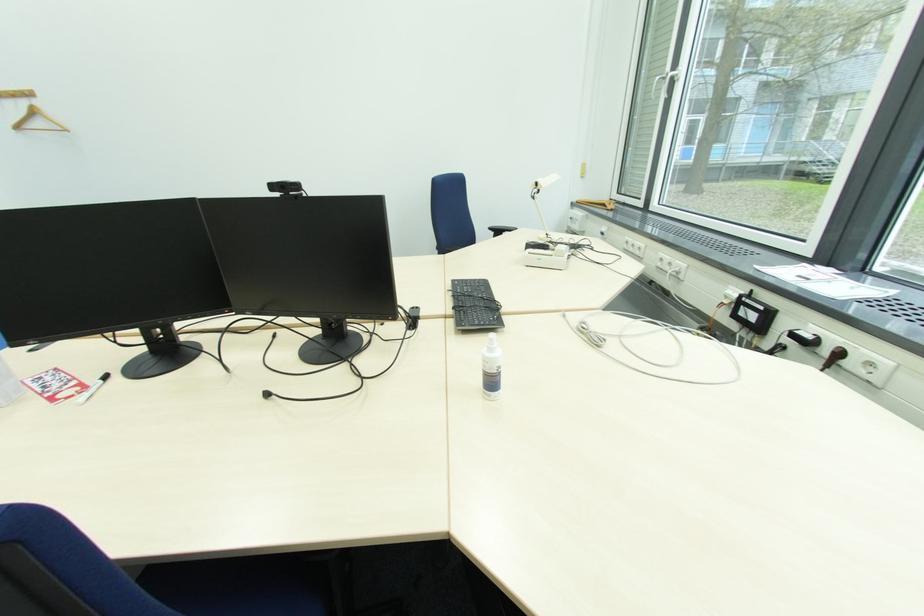
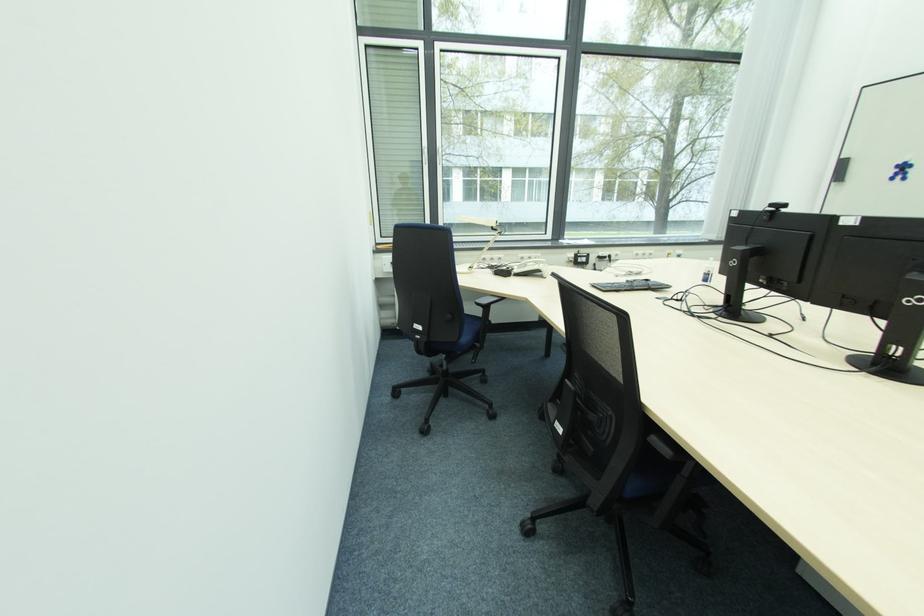
Question: I am providing you with two images of the same scene from different viewpoints. After the viewpoint changes to image2, which objects are now occluded?

Choices:
 (A) blue chair sitting surface
 (B) black webcam
 (C) clothes drying rack
 (D) telephone handset

Answer: (B)